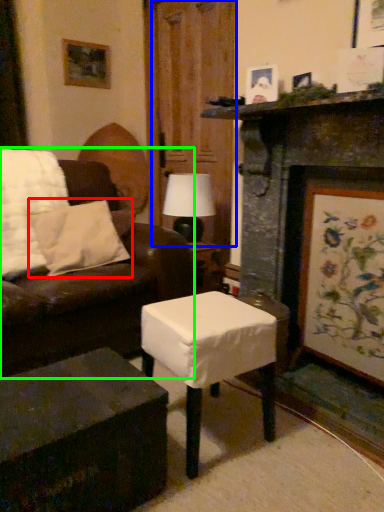
Question: Which is farther away from pillow (highlighted by a red box)? glass door (highlighted by a blue box) or studio couch (highlighted by a green box)?

Choices:
 (A) glass door
 (B) studio couch

Answer: (A)